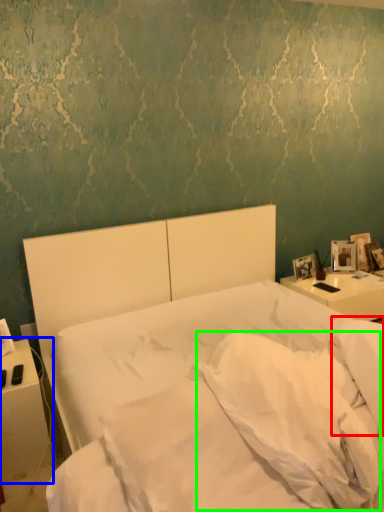
Question: Which object is positioned farthest from pillow (highlighted by a red box)? Select from nightstand (highlighted by a blue box) and pillow (highlighted by a green box).

Choices:
 (A) nightstand
 (B) pillow

Answer: (A)